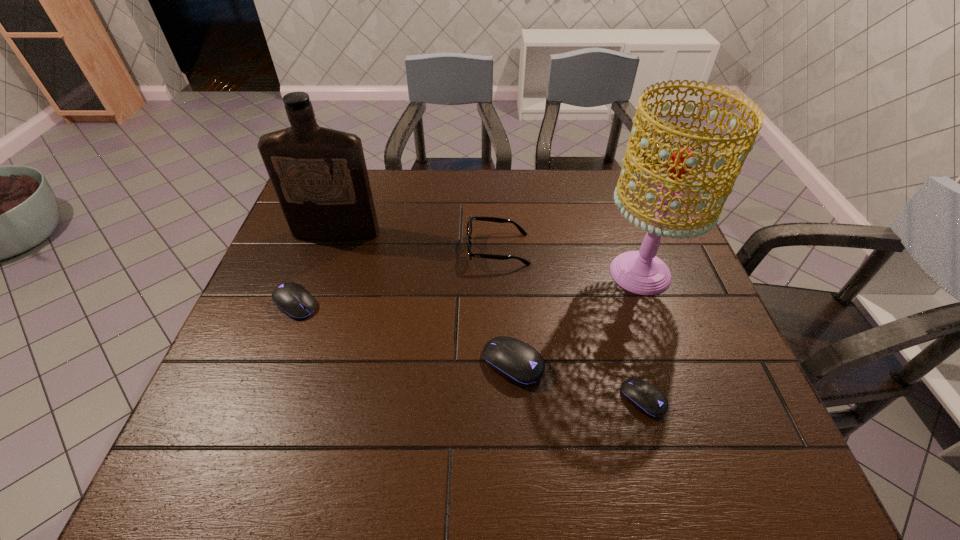
Identify the location of vacant space at the far edge of the desktop. (417, 183).

Where is `free space at the near edge of the desktop`? free space at the near edge of the desktop is located at coordinates (339, 414).

The width and height of the screenshot is (960, 540). In the image, there is a desktop. Find the location of `free region at the left edge`. free region at the left edge is located at coordinates (321, 283).

Where is `free spot at the right edge of the desktop`? free spot at the right edge of the desktop is located at coordinates (681, 327).

Where is `vacant area that lies between the shortest object and the liquor`? The width and height of the screenshot is (960, 540). vacant area that lies between the shortest object and the liquor is located at coordinates (490, 316).

Locate an element on the screen. free space between the tallest computer mouse and the rightmost computer mouse is located at coordinates (578, 381).

I want to click on empty space between the lampshade and the shortest computer mouse, so click(641, 336).

You are a GUI agent. You are given a task and a screenshot of the screen. Output one action in this format:
    pyautogui.click(x=<x>, y=<y>)
    Task: Click on the free spot between the liquor and the leftmost computer mouse
    
    Given the screenshot: What is the action you would take?
    pyautogui.click(x=316, y=268)

I want to click on vacant space that's between the liquor and the second computer mouse from left to right, so click(x=424, y=298).

At what (x,y) coordinates should I click in order to perform the action: click on vacant space that's between the liquor and the spectacles. Please return your answer as a coordinate pair (x, y). Looking at the image, I should click on (417, 241).